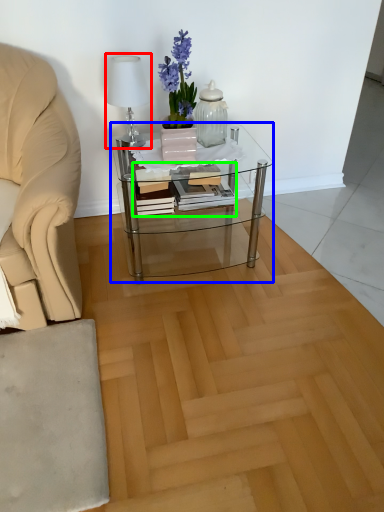
Question: Based on their relative distances, which object is farther from table lamp (highlighted by a red box)? Choose from coffee table (highlighted by a blue box) and book (highlighted by a green box).

Choices:
 (A) coffee table
 (B) book

Answer: (A)